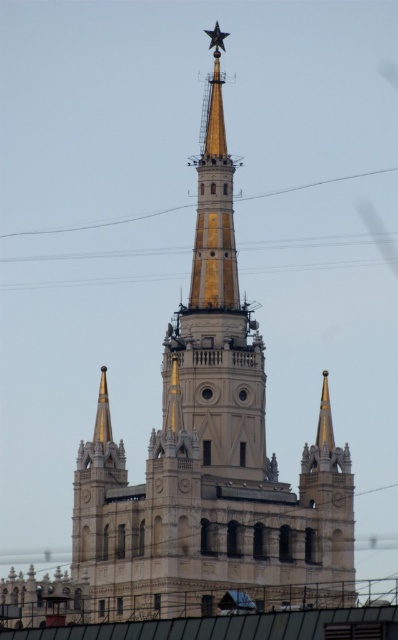
You are standing in front of the tower and want to take a photo. You notice two points on the tower marked as point 1 at coordinates point [206,264] and point 2 at coordinates point [210,38]. Which point is closer to your camera lens when taking the photo?

Point [206,264] is closer to the camera than point [210,38].

You are an architect examining the tower. You need to determine the relative positions of the gold polished metal spire at center and the metallic gold star at upper center. Which object is located to the right of the other?

The gold polished metal spire at center is positioned on the right side of metallic gold star at upper center, so the spire is to the right of the star.